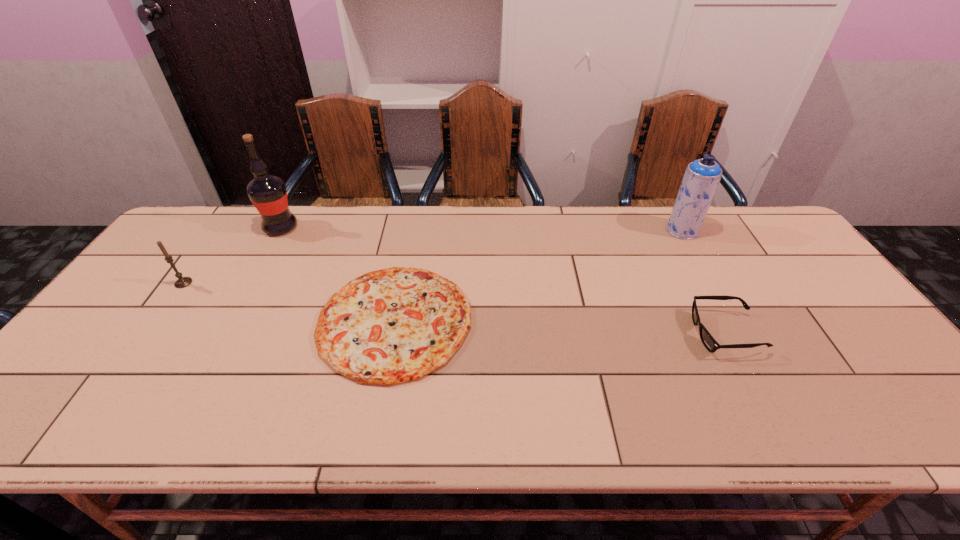
Find the location of `blank area at the left edge`. blank area at the left edge is located at coordinates (180, 253).

You are a GUI agent. You are given a task and a screenshot of the screen. Output one action in this format:
    pyautogui.click(x=<x>, y=<y>)
    Task: Click on the free location at the right edge of the desktop
    
    Given the screenshot: What is the action you would take?
    pyautogui.click(x=748, y=255)

In the image, there is a desktop. Identify the location of vacant space at the far left corner. The image size is (960, 540). (217, 219).

This screenshot has width=960, height=540. I want to click on vacant area between the fourth tallest object and the shortest object, so (x=560, y=327).

The height and width of the screenshot is (540, 960). I want to click on free spot between the pizza and the second object from left to right, so click(x=338, y=274).

You are a GUI agent. You are given a task and a screenshot of the screen. Output one action in this format:
    pyautogui.click(x=<x>, y=<y>)
    Task: Click on the free space that is in between the fourth shortest object and the sunglasses
    This screenshot has width=960, height=540.
    Given the screenshot: What is the action you would take?
    pyautogui.click(x=704, y=282)

I want to click on vacant space in between the pizza and the candle, so click(x=289, y=302).

The height and width of the screenshot is (540, 960). I want to click on free space between the third object from right to left and the third shortest object, so click(289, 302).

Identify the location of vacant space that is in between the fourth tallest object and the fourth shortest object. The width and height of the screenshot is (960, 540). (704, 282).

This screenshot has height=540, width=960. What are the coordinates of `vacant area between the sunglasses and the pizza` in the screenshot? It's located at [x=560, y=327].